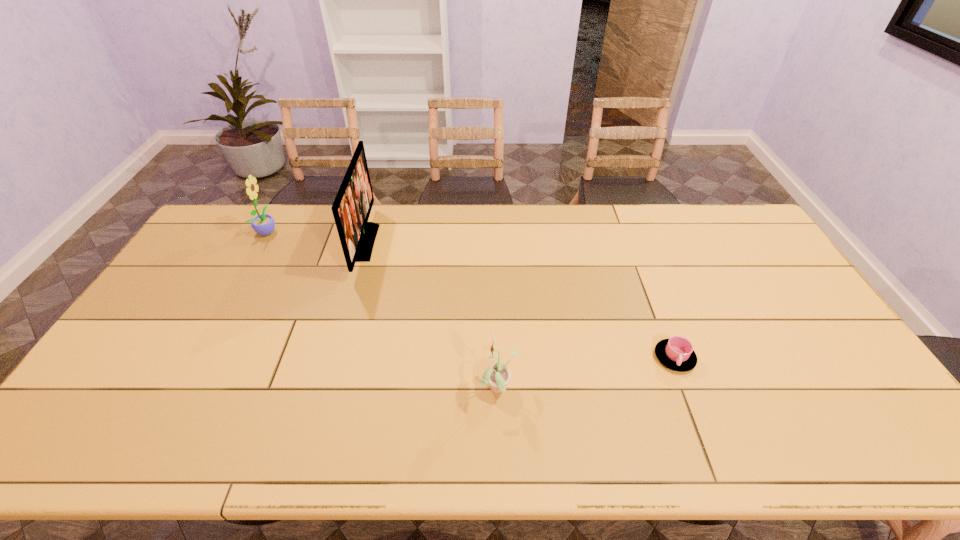
Identify the location of the second object from left to right. (351, 209).

Locate an element on the screen. the tallest object is located at coordinates (351, 209).

The height and width of the screenshot is (540, 960). What are the coordinates of `the farther sunflower` in the screenshot? It's located at (263, 224).

Where is `the left sunflower`? The image size is (960, 540). the left sunflower is located at coordinates (263, 224).

Where is `the second object from right to left`? the second object from right to left is located at coordinates (497, 375).

Where is `the right sunflower`? Image resolution: width=960 pixels, height=540 pixels. the right sunflower is located at coordinates (497, 375).

Locate an element on the screen. cup is located at coordinates (676, 353).

This screenshot has height=540, width=960. I want to click on the shortest object, so click(x=676, y=353).

Find the location of a particular element. The height and width of the screenshot is (540, 960). free space located 0.050m on the front-facing side of the monitor is located at coordinates (390, 242).

This screenshot has width=960, height=540. I want to click on free space located 0.270m on the front-facing side of the leftmost object, so click(x=353, y=231).